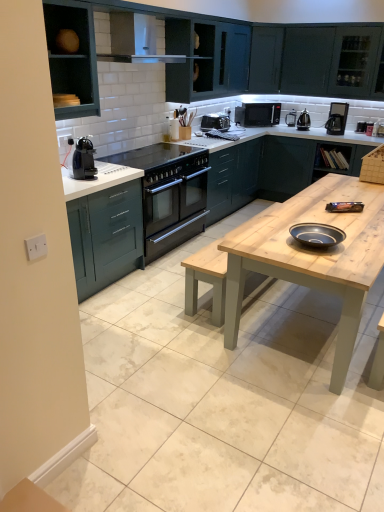
Question: Which direction should I rotate to look at satin black toaster at upper center, the 1th appliance positioned from the left, — up or down?

Choices:
 (A) up
 (B) down

Answer: (A)

Question: Is black plastic coffee machine at left outside of teal matte cabinet at upper left, placed as the 1th cabinetry when sorted from left to right?

Choices:
 (A) yes
 (B) no

Answer: (A)

Question: Is black plastic coffee machine at left shorter than teal matte cabinet at upper left, placed as the 1th cabinetry when sorted from left to right?

Choices:
 (A) no
 (B) yes

Answer: (B)

Question: Is black plastic coffee machine at left next to teal matte cabinet at upper left, arranged as the 4th cabinetry when viewed from the back, and touching it?

Choices:
 (A) yes
 (B) no

Answer: (B)

Question: Can you confirm if black plastic coffee machine at left is thinner than teal matte cabinet at upper left, placed as the 1th cabinetry when sorted from left to right?

Choices:
 (A) no
 (B) yes

Answer: (B)

Question: Does black plastic coffee machine at left have a smaller size compared to teal matte cabinet at upper left, arranged as the 1th cabinetry when viewed from the front?

Choices:
 (A) no
 (B) yes

Answer: (B)

Question: Does black plastic coffee machine at left turn towards teal matte cabinet at upper left, arranged as the 4th cabinetry when viewed from the back?

Choices:
 (A) yes
 (B) no

Answer: (B)

Question: From the image's perspective, is polished stainless steel kettle at upper right, which appears as the 3th appliance when viewed from the left, on top of black matte microwave at upper right?

Choices:
 (A) yes
 (B) no

Answer: (B)

Question: Can you confirm if polished stainless steel kettle at upper right, which appears as the 3th appliance when viewed from the left, is taller than black matte microwave at upper right?

Choices:
 (A) no
 (B) yes

Answer: (A)

Question: Does polished stainless steel kettle at upper right, arranged as the second appliance when viewed from the right, have a larger size compared to black matte microwave at upper right?

Choices:
 (A) no
 (B) yes

Answer: (A)

Question: Is polished stainless steel kettle at upper right, arranged as the second appliance when viewed from the right, far from black matte microwave at upper right?

Choices:
 (A) no
 (B) yes

Answer: (A)

Question: Is polished stainless steel kettle at upper right, which appears as the 3th appliance when viewed from the left, not inside black matte microwave at upper right?

Choices:
 (A) yes
 (B) no

Answer: (A)

Question: Considering the relative positions of polished stainless steel kettle at upper right, which appears as the 3th appliance when viewed from the left, and black matte microwave at upper right in the image provided, is polished stainless steel kettle at upper right, which appears as the 3th appliance when viewed from the left, in front of black matte microwave at upper right?

Choices:
 (A) yes
 (B) no

Answer: (A)

Question: Is teal matte cabinet at upper left, placed as the 1th cabinetry when sorted from left to right, behind wooden countertop at right, the 2th cabinetry viewed from the right?

Choices:
 (A) yes
 (B) no

Answer: (B)